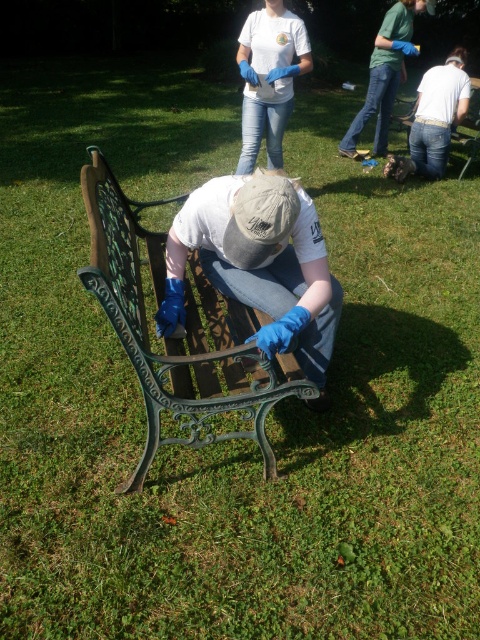
Is green patinated metal bench at center to the right of matte black bench at center from the viewer's perspective?

Incorrect, green patinated metal bench at center is not on the right side of matte black bench at center.

What do you see at coordinates (178, 339) in the screenshot?
I see `green patinated metal bench at center` at bounding box center [178, 339].

Find the location of `green patinated metal bench at center`. green patinated metal bench at center is located at coordinates (178, 339).

Is matte black bench at center positioned before matte white t-shirt at upper center?

Yes, it is in front of matte white t-shirt at upper center.

Which is behind, point (171, 228) or point (310, 49)?

The point (310, 49) is more distant.

In order to click on matte black bench at center in this screenshot , I will do `click(259, 264)`.

Between point (168, 355) and point (286, 100), which one is positioned behind?

The point (286, 100) is more distant.

Does green patinated metal bench at center lie behind matte white t-shirt at upper center?

No.

Is point (286, 356) less distant than point (252, 161)?

Yes, point (286, 356) is closer to viewer.

Find the location of a particular element. The width and height of the screenshot is (480, 640). green patinated metal bench at center is located at coordinates click(178, 339).